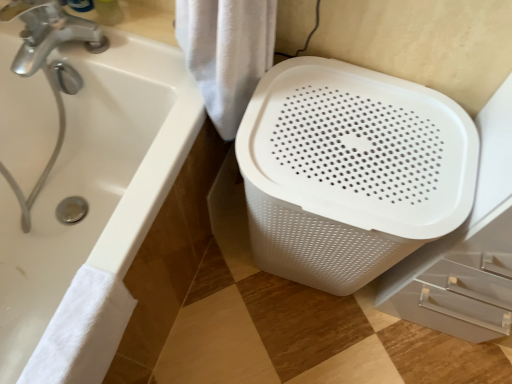
Find the location of `white glossy bathtub at lower left`. white glossy bathtub at lower left is located at coordinates (93, 212).

Does white fluffy towel at lower left, placed as the 1th bath towel when sorted from left to right, come behind white fabric towel at center, which is the 1th bath towel in right-to-left order?

Answer: No, white fluffy towel at lower left, placed as the 1th bath towel when sorted from left to right, is closer to the camera.

From the image's perspective, between white fluffy towel at lower left, the 1th bath towel ordered from the bottom, and white fabric towel at center, the 2th bath towel positioned from the left, which one is located above?

From the image's view, white fabric towel at center, the 2th bath towel positioned from the left, is above.

Would you say white fluffy towel at lower left, the 1th bath towel ordered from the bottom, is to the left or to the right of white fabric towel at center, arranged as the 1th bath towel when viewed from the top, in the picture?

In the image, white fluffy towel at lower left, the 1th bath towel ordered from the bottom, appears on the left side of white fabric towel at center, arranged as the 1th bath towel when viewed from the top.

Is white fluffy towel at lower left, the 1th bath towel ordered from the bottom, positioned with its back to white fabric towel at center, the 2th bath towel positioned from the left?

No.

From a real-world perspective, between white glossy bathtub at lower left and white fabric towel at center, which is the 1th bath towel in right-to-left order, who is vertically lower?

white glossy bathtub at lower left is physically lower.

Can you confirm if white glossy bathtub at lower left is bigger than white fabric towel at center, arranged as the 1th bath towel when viewed from the top?

Correct, white glossy bathtub at lower left is larger in size than white fabric towel at center, arranged as the 1th bath towel when viewed from the top.

Is point (99, 303) less distant than point (186, 43)?

Yes.

Is white fabric towel at center, the second bath towel positioned from the bottom, directly adjacent to white glossy bathtub at lower left?

white fabric towel at center, the second bath towel positioned from the bottom, is not next to white glossy bathtub at lower left, and they're not touching.

Would you say white fabric towel at center, which is the 1th bath towel in right-to-left order, is inside or outside white glossy bathtub at lower left?

white fabric towel at center, which is the 1th bath towel in right-to-left order, is not inside white glossy bathtub at lower left, it's outside.

Is white fabric towel at center, arranged as the 1th bath towel when viewed from the top, taller or shorter than white glossy bathtub at lower left?

In the image, white fabric towel at center, arranged as the 1th bath towel when viewed from the top, appears to be shorter than white glossy bathtub at lower left.

Who is bigger, white fabric towel at center, the 2th bath towel positioned from the left, or white glossy bathtub at lower left?

With larger size is white glossy bathtub at lower left.

Is white fluffy towel at lower left, placed as the 1th bath towel when sorted from left to right, oriented towards white glossy bathtub at lower left?

Yes, white fluffy towel at lower left, placed as the 1th bath towel when sorted from left to right, faces towards white glossy bathtub at lower left.

You are a GUI agent. You are given a task and a screenshot of the screen. Output one action in this format:
    pyautogui.click(x=<x>, y=<y>)
    Task: Click on the bathtub lying on the left of white fluffy towel at lower left, positioned as the 2th bath towel in top-to-bottom order
    The height and width of the screenshot is (384, 512).
    Given the screenshot: What is the action you would take?
    pyautogui.click(x=93, y=212)

Is white glossy bathtub at lower left completely or partially inside white fluffy towel at lower left, the 1th bath towel ordered from the bottom?

Definitely not — white glossy bathtub at lower left is not inside white fluffy towel at lower left, the 1th bath towel ordered from the bottom.

Measure the distance between white fluffy towel at lower left, the second bath towel in the right-to-left sequence, and white glossy bathtub at lower left.

They are 9.94 inches apart.

From a real-world perspective, is white fabric towel at center, arranged as the 1th bath towel when viewed from the top, above or below white fluffy towel at lower left, the 1th bath towel ordered from the bottom?

From a real-world perspective, white fabric towel at center, arranged as the 1th bath towel when viewed from the top, is physically above white fluffy towel at lower left, the 1th bath towel ordered from the bottom.

Can we say white fabric towel at center, arranged as the 1th bath towel when viewed from the top, lies outside white fluffy towel at lower left, placed as the 1th bath towel when sorted from left to right?

white fabric towel at center, arranged as the 1th bath towel when viewed from the top, is positioned outside white fluffy towel at lower left, placed as the 1th bath towel when sorted from left to right.

Would you say white fabric towel at center, arranged as the 1th bath towel when viewed from the top, is a long distance from white fluffy towel at lower left, placed as the 1th bath towel when sorted from left to right?

No, white fabric towel at center, arranged as the 1th bath towel when viewed from the top, is not far away from white fluffy towel at lower left, placed as the 1th bath towel when sorted from left to right.

Are white glossy bathtub at lower left and white fluffy towel at lower left, the 1th bath towel ordered from the bottom, far apart?

No.

Do you think white glossy bathtub at lower left is within white fluffy towel at lower left, the 1th bath towel ordered from the bottom, or outside of it?

white glossy bathtub at lower left is not inside white fluffy towel at lower left, the 1th bath towel ordered from the bottom, it's outside.

Locate an element on the screen. This screenshot has width=512, height=384. bath towel directly beneath the white fabric towel at center, the 2th bath towel positioned from the left (from a real-world perspective) is located at coordinates (82, 331).

From a real-world perspective, starting from the white glossy bathtub at lower left, which bath towel is the 2nd one vertically above it? Please provide its 2D coordinates.

[(226, 53)]

From the image, which object appears to be farther from white fluffy towel at lower left, positioned as the 2th bath towel in top-to-bottom order, white glossy bathtub at lower left or white fabric towel at center, the second bath towel positioned from the bottom?

white fabric towel at center, the second bath towel positioned from the bottom, is positioned further to the anchor white fluffy towel at lower left, positioned as the 2th bath towel in top-to-bottom order.

Considering their positions, is white fabric towel at center, the 2th bath towel positioned from the left, positioned closer to white fluffy towel at lower left, placed as the 1th bath towel when sorted from left to right, than white glossy bathtub at lower left?

white glossy bathtub at lower left is positioned closer to the anchor white fluffy towel at lower left, placed as the 1th bath towel when sorted from left to right.

Looking at the image, which one is located further to white glossy bathtub at lower left, white fabric towel at center, arranged as the 1th bath towel when viewed from the top, or white fluffy towel at lower left, placed as the 1th bath towel when sorted from left to right?

white fabric towel at center, arranged as the 1th bath towel when viewed from the top, is positioned further to the anchor white glossy bathtub at lower left.

Which object lies nearer to the anchor point white fabric towel at center, arranged as the 1th bath towel when viewed from the top, white glossy bathtub at lower left or white fluffy towel at lower left, the second bath towel in the right-to-left sequence?

Among the two, white glossy bathtub at lower left is located nearer to white fabric towel at center, arranged as the 1th bath towel when viewed from the top.

Considering their positions, is white fluffy towel at lower left, placed as the 1th bath towel when sorted from left to right, positioned further to white glossy bathtub at lower left than white fabric towel at center, which is the 1th bath towel in right-to-left order?

Among the two, white fabric towel at center, which is the 1th bath towel in right-to-left order, is located further to white glossy bathtub at lower left.

From the image, which object appears to be nearer to white fabric towel at center, the 2th bath towel positioned from the left, white fluffy towel at lower left, placed as the 1th bath towel when sorted from left to right, or white glossy bathtub at lower left?

Based on the image, white glossy bathtub at lower left appears to be nearer to white fabric towel at center, the 2th bath towel positioned from the left.

Image resolution: width=512 pixels, height=384 pixels. Find the location of `bathtub between white fabric towel at center, which is the 1th bath towel in right-to-left order, and white fluffy towel at lower left, the second bath towel in the right-to-left sequence, in the up-down direction`. bathtub between white fabric towel at center, which is the 1th bath towel in right-to-left order, and white fluffy towel at lower left, the second bath towel in the right-to-left sequence, in the up-down direction is located at coordinates (93, 212).